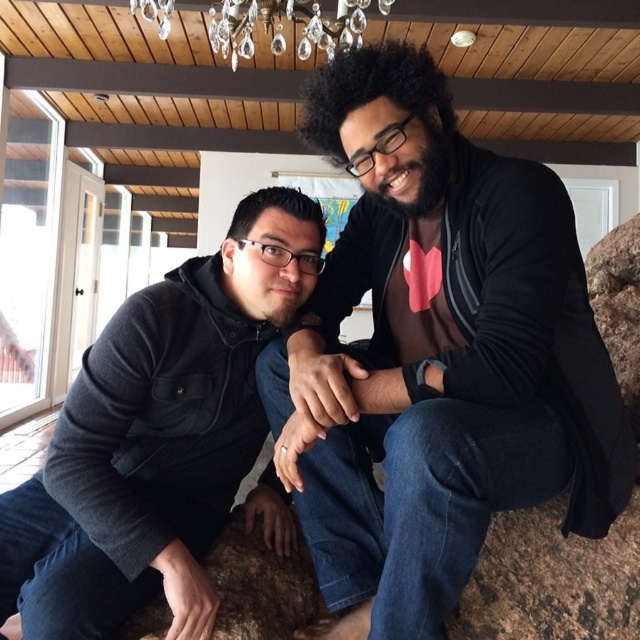
Question: Which of the following is the farthest from the observer?

Choices:
 (A) dark gray hoodie at left
 (B) black matte jacket at center

Answer: (A)

Question: Which point is farther from the camera taking this photo?

Choices:
 (A) (164, 6)
 (B) (624, 444)
 (C) (48, 515)

Answer: (A)

Question: Is black matte jacket at center to the right of dark gray hoodie at left from the viewer's perspective?

Choices:
 (A) yes
 (B) no

Answer: (A)

Question: Can you confirm if dark gray hoodie at left is bigger than crystal glass chandelier at upper center?

Choices:
 (A) yes
 (B) no

Answer: (B)

Question: Which point appears farthest from the camera in this image?

Choices:
 (A) (83, 540)
 (B) (305, 17)
 (C) (605, 410)

Answer: (B)

Question: Observing the image, what is the correct spatial positioning of black matte jacket at center in reference to crystal glass chandelier at upper center?

Choices:
 (A) above
 (B) below

Answer: (B)